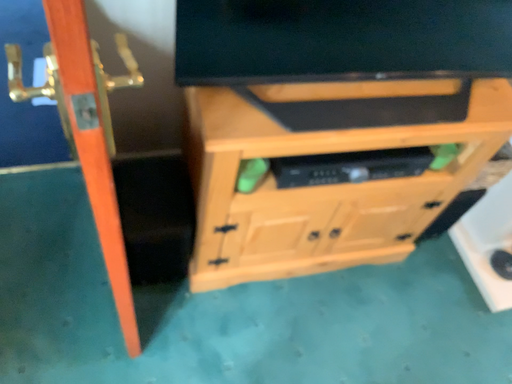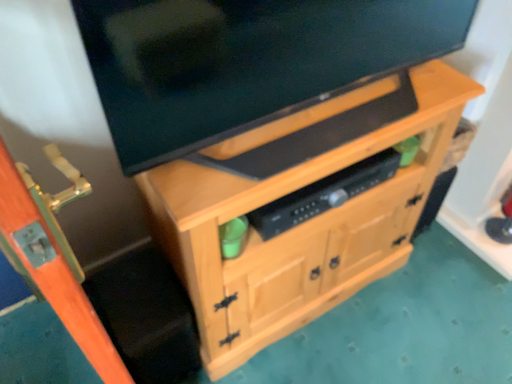
Question: How did the camera likely rotate when shooting the video?

Choices:
 (A) rotated downward
 (B) rotated upward

Answer: (B)